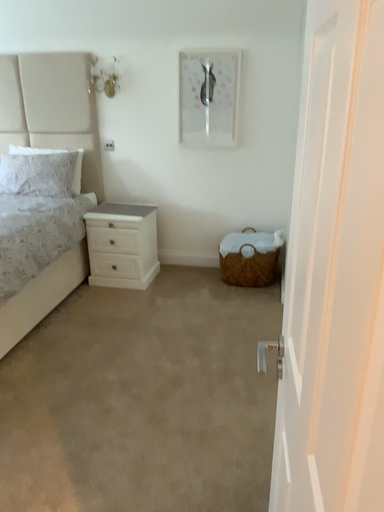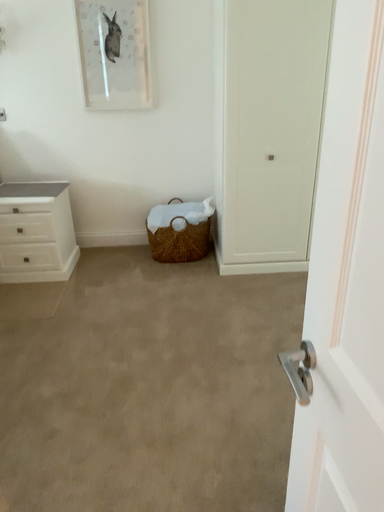
Question: How did the camera likely rotate when shooting the video?

Choices:
 (A) rotated right
 (B) rotated left

Answer: (A)